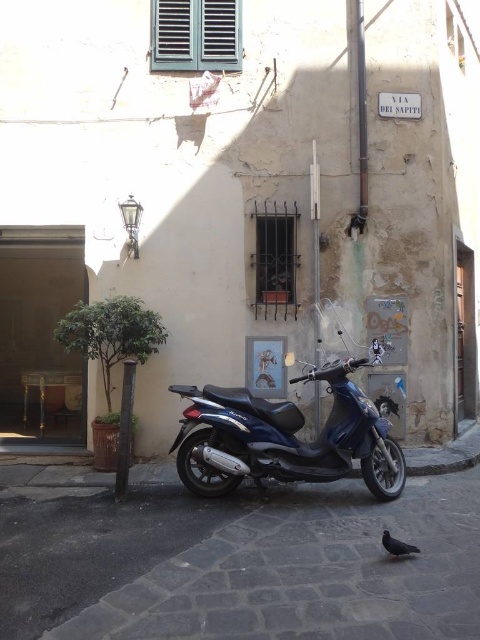
Does shiny blue scooter at center come in front of dark gray feathered pigeon at lower right?

No, shiny blue scooter at center is further to the viewer.

Does shiny blue scooter at center appear on the left side of dark gray feathered pigeon at lower right?

Yes, shiny blue scooter at center is to the left of dark gray feathered pigeon at lower right.

Where is `shiny blue scooter at center`? shiny blue scooter at center is located at coordinates (286, 436).